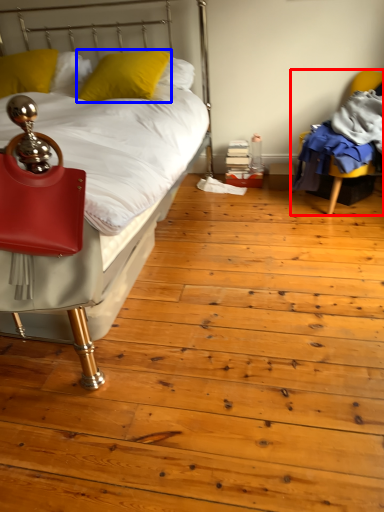
Question: Which object appears farthest to the camera in this image, chair (highlighted by a red box) or pillow (highlighted by a blue box)?

Choices:
 (A) chair
 (B) pillow

Answer: (B)